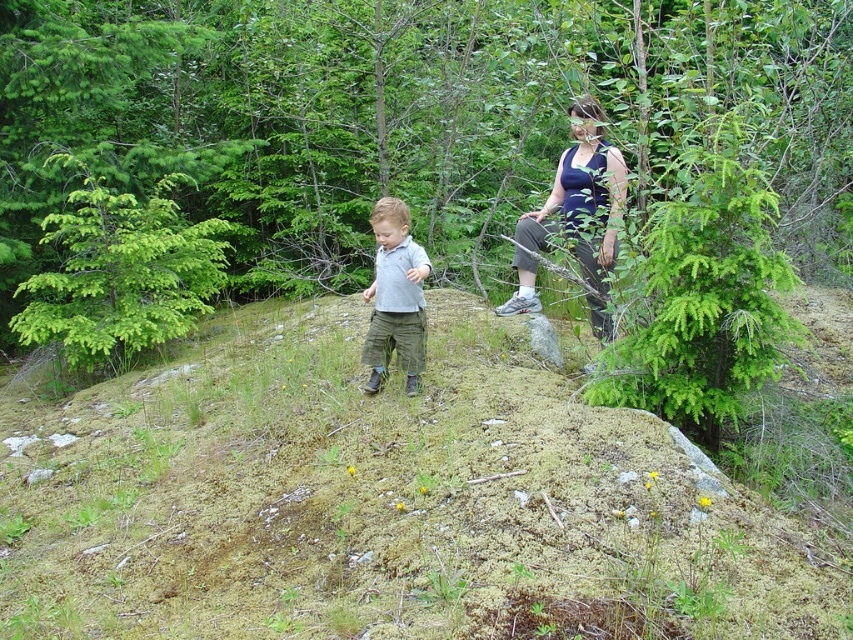
You are a hiker standing at the center of the forest scene. You notice the green mossy hillside at center and the light gray cotton shirt at center. Which object is positioned lower in the image?

The green mossy hillside at center is below the light gray cotton shirt at center, so the green mossy hillside at center is positioned lower in the image.

You are standing at point (402, 118) in the forest. What is the closest object to you?

The closest object to you is the green leafy tree at center located at point (402, 118).

You are a hiker who wants to wear a shirt that matches the color of the moss in the scene. Which of the two shirts, the dark blue tank top at upper right or the light gray cotton shirt at center, would better match the moss color?

The light gray cotton shirt at center would better match the moss color because the moss is described as green, and light gray is closer to green than dark blue.